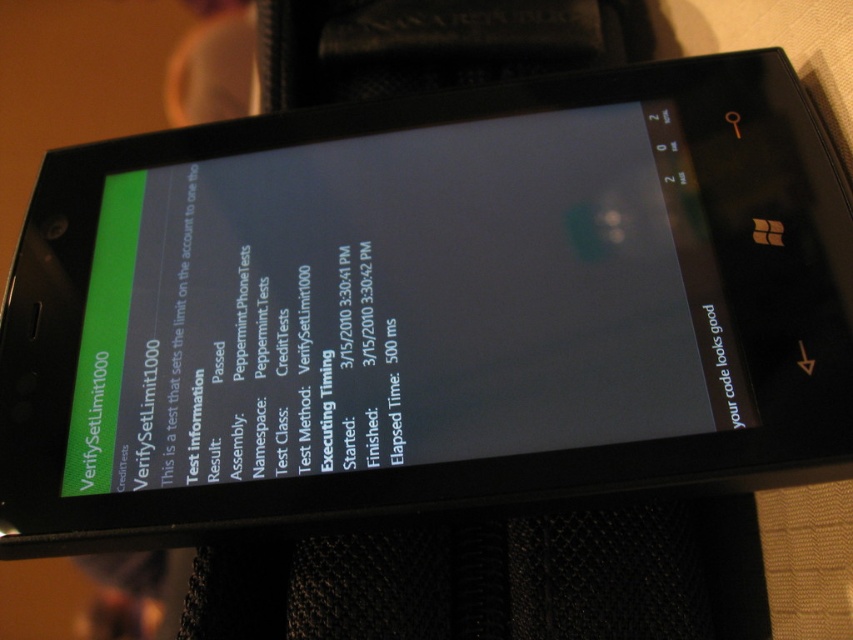
Question: Among these points, which one is nearest to the camera?

Choices:
 (A) (668, 195)
 (B) (167, 202)

Answer: (A)

Question: Is matte black screen at center thinner than green matte text at upper left?

Choices:
 (A) no
 (B) yes

Answer: (A)

Question: Does matte black screen at center appear on the left side of green matte text at upper left?

Choices:
 (A) no
 (B) yes

Answer: (A)

Question: Is matte black screen at center to the right of green matte text at upper left from the viewer's perspective?

Choices:
 (A) no
 (B) yes

Answer: (B)